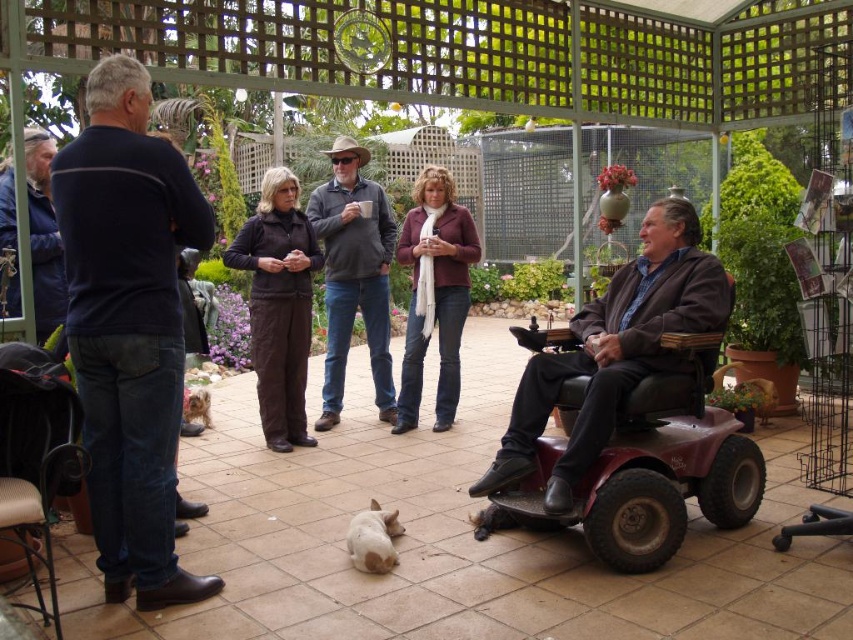
Can you confirm if dark gray sweater at center is taller than white fur dog at center?

Yes.

Who is lower down, dark gray sweater at center or white fur dog at center?

white fur dog at center

Does point (367, 305) come farther from viewer compared to point (383, 554)?

That is True.

Locate an element on the screen. This screenshot has height=640, width=853. dark gray sweater at center is located at coordinates (352, 275).

How much distance is there between matte brown scooter at center and white fur dog at center?

The distance of matte brown scooter at center from white fur dog at center is 37.64 inches.

Describe the element at coordinates (614, 349) in the screenshot. I see `matte brown scooter at center` at that location.

This screenshot has width=853, height=640. Identify the location of matte brown scooter at center. (614, 349).

Is dark blue sweater at left to the right of matte brown scooter at center from the viewer's perspective?

No, dark blue sweater at left is not to the right of matte brown scooter at center.

Can you confirm if dark blue sweater at left is shorter than matte brown scooter at center?

In fact, dark blue sweater at left may be taller than matte brown scooter at center.

Is point (158, 570) farther from camera compared to point (671, 211)?

No, (158, 570) is closer to viewer.

This screenshot has width=853, height=640. I want to click on dark blue sweater at left, so click(x=129, y=326).